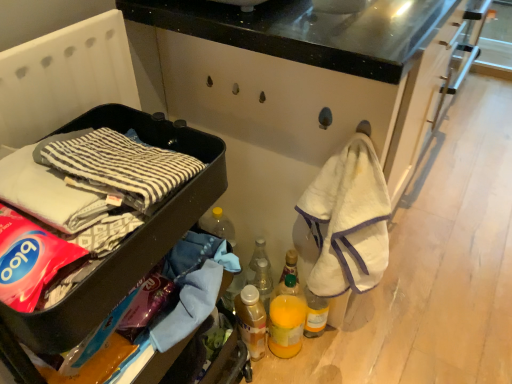
I want to click on translucent plastic bottle at center, arranged as the 1th bottle when viewed from the top, so click(262, 280).

Where is `translucent plastic bottle at center, the second bottle ordered from the bottom`? This screenshot has width=512, height=384. translucent plastic bottle at center, the second bottle ordered from the bottom is located at coordinates (262, 280).

Is the position of black plastic container at left more distant than that of translucent plastic bottle at center, arranged as the 1th bottle when viewed from the top?

No, black plastic container at left is closer to the camera.

Consider the image. From their relative heights in the image, would you say black plastic container at left is taller or shorter than translucent plastic bottle at center, the second bottle ordered from the bottom?

In the image, black plastic container at left appears to be taller than translucent plastic bottle at center, the second bottle ordered from the bottom.

Would you say translucent plastic bottle at center, arranged as the 1th bottle when viewed from the top, is part of black plastic container at left's contents?

Actually, translucent plastic bottle at center, arranged as the 1th bottle when viewed from the top, is outside black plastic container at left.

Which object is thinner, black plastic container at left or translucent plastic bottle at center, arranged as the 1th bottle when viewed from the top?

translucent plastic bottle at center, arranged as the 1th bottle when viewed from the top, is thinner.

Considering the sizes of objects translucent plastic bottle at center, the second bottle ordered from the bottom, and black plastic container at left in the image provided, who is smaller, translucent plastic bottle at center, the second bottle ordered from the bottom, or black plastic container at left?

translucent plastic bottle at center, the second bottle ordered from the bottom.

Between translucent plastic bottle at center, arranged as the 1th bottle when viewed from the top, and black plastic container at left, which one appears on the left side from the viewer's perspective?

Positioned to the left is black plastic container at left.

The width and height of the screenshot is (512, 384). I want to click on furniture on the left of the translucent plastic bottle at center, the second bottle ordered from the bottom, so [x=122, y=243].

Considering their positions, is translucent plastic bottle at center, the second bottle ordered from the bottom, located in front of or behind black plastic container at left?

Visually, translucent plastic bottle at center, the second bottle ordered from the bottom, is located behind black plastic container at left.

Could you tell me if translucent plastic bottle at center, arranged as the 1th bottle when viewed from the top, is facing translucent plastic bottle at lower center, the first bottle ordered from the bottom?

No, translucent plastic bottle at center, arranged as the 1th bottle when viewed from the top, is not aimed at translucent plastic bottle at lower center, the first bottle ordered from the bottom.

Consider the image. Is translucent plastic bottle at center, the second bottle ordered from the bottom, positioned behind translucent plastic bottle at lower center, the second bottle positioned from the top?

Yes.

Which is more to the left, translucent plastic bottle at center, arranged as the 1th bottle when viewed from the top, or translucent plastic bottle at lower center, the second bottle positioned from the top?

Positioned to the left is translucent plastic bottle at lower center, the second bottle positioned from the top.

Is translucent plastic bottle at lower center, the second bottle positioned from the top, to the left or to the right of translucent plastic bottle at center, the second bottle ordered from the bottom, in the image?

Based on their positions, translucent plastic bottle at lower center, the second bottle positioned from the top, is located to the left of translucent plastic bottle at center, the second bottle ordered from the bottom.

In the scene shown: From a real-world perspective, relative to translucent plastic bottle at center, the second bottle ordered from the bottom, is translucent plastic bottle at lower center, the first bottle ordered from the bottom, vertically above or below?

translucent plastic bottle at lower center, the first bottle ordered from the bottom, is situated lower than translucent plastic bottle at center, the second bottle ordered from the bottom, in the real world.

Is translucent plastic bottle at center, arranged as the 1th bottle when viewed from the top, inside translucent plastic bottle at lower center, the second bottle positioned from the top?

Definitely not — translucent plastic bottle at center, arranged as the 1th bottle when viewed from the top, is not inside translucent plastic bottle at lower center, the second bottle positioned from the top.

Which is farther, (55,345) or (244,313)?

Positioned behind is point (244,313).

Which of these two, black plastic container at left or translucent plastic bottle at lower center, the second bottle positioned from the top, stands shorter?

Standing shorter between the two is translucent plastic bottle at lower center, the second bottle positioned from the top.

Is black plastic container at left oriented away from translucent plastic bottle at lower center, the first bottle ordered from the bottom?

black plastic container at left is not turned away from translucent plastic bottle at lower center, the first bottle ordered from the bottom.

You are a GUI agent. You are given a task and a screenshot of the screen. Output one action in this format:
    pyautogui.click(x=<x>, y=<y>)
    Task: Click on the bottle below the black plastic container at left (from the image's perspective)
    The width and height of the screenshot is (512, 384).
    Given the screenshot: What is the action you would take?
    pyautogui.click(x=251, y=321)

From a real-world perspective, is translucent plastic bottle at lower center, the second bottle positioned from the top, positioned over black plastic container at left based on gravity?

No, from a real-world perspective, translucent plastic bottle at lower center, the second bottle positioned from the top, is not above black plastic container at left.

Between translucent plastic bottle at lower center, the second bottle positioned from the top, and black plastic container at left, which one has smaller size?

translucent plastic bottle at lower center, the second bottle positioned from the top.

From the picture: Is translucent plastic bottle at lower center, the first bottle ordered from the bottom, taller or shorter than black plastic container at left?

translucent plastic bottle at lower center, the first bottle ordered from the bottom, is shorter than black plastic container at left.

This screenshot has width=512, height=384. I want to click on furniture above the translucent plastic bottle at center, the second bottle ordered from the bottom (from a real-world perspective), so click(122, 243).

From a real-world perspective, starting from the black plastic container at left, which bottle is the 1st one below it? Please provide its 2D coordinates.

[(262, 280)]

Based on their spatial positions, is black plastic container at left or translucent plastic bottle at lower center, the first bottle ordered from the bottom, further from translucent plastic bottle at center, the second bottle ordered from the bottom?

Based on the image, black plastic container at left appears to be further to translucent plastic bottle at center, the second bottle ordered from the bottom.

From the image, which object appears to be nearer to black plastic container at left, translucent plastic bottle at lower center, the second bottle positioned from the top, or translucent plastic bottle at center, arranged as the 1th bottle when viewed from the top?

Among the two, translucent plastic bottle at lower center, the second bottle positioned from the top, is located nearer to black plastic container at left.

Based on their spatial positions, is translucent plastic bottle at center, arranged as the 1th bottle when viewed from the top, or black plastic container at left further from translucent plastic bottle at lower center, the first bottle ordered from the bottom?

The object further to translucent plastic bottle at lower center, the first bottle ordered from the bottom, is black plastic container at left.

Estimate the real-world distances between objects in this image. Which object is further from translucent plastic bottle at center, arranged as the 1th bottle when viewed from the top, translucent plastic bottle at lower center, the first bottle ordered from the bottom, or black plastic container at left?

black plastic container at left.

From the image, which object appears to be farther from black plastic container at left, translucent plastic bottle at center, the second bottle ordered from the bottom, or translucent plastic bottle at lower center, the second bottle positioned from the top?

translucent plastic bottle at center, the second bottle ordered from the bottom.

Considering their positions, is black plastic container at left positioned closer to translucent plastic bottle at lower center, the second bottle positioned from the top, than translucent plastic bottle at center, arranged as the 1th bottle when viewed from the top?

The object closer to translucent plastic bottle at lower center, the second bottle positioned from the top, is translucent plastic bottle at center, arranged as the 1th bottle when viewed from the top.

Image resolution: width=512 pixels, height=384 pixels. Identify the location of bottle between black plastic container at left and translucent plastic bottle at center, the second bottle ordered from the bottom, in the front-back direction. (251, 321).